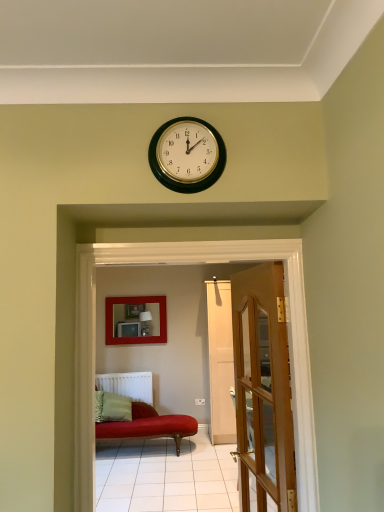
Question: Could you tell me if wooden glass door at center is turned towards green fabric pillow at lower left?

Choices:
 (A) no
 (B) yes

Answer: (A)

Question: From the image's perspective, does wooden glass door at center appear higher than green fabric pillow at lower left?

Choices:
 (A) yes
 (B) no

Answer: (A)

Question: Would you say wooden glass door at center is a long distance from green fabric pillow at lower left?

Choices:
 (A) yes
 (B) no

Answer: (A)

Question: Is wooden glass door at center wider than green fabric pillow at lower left?

Choices:
 (A) yes
 (B) no

Answer: (B)

Question: Considering the relative positions of wooden glass door at center and green fabric pillow at lower left in the image provided, is wooden glass door at center to the left of green fabric pillow at lower left from the viewer's perspective?

Choices:
 (A) yes
 (B) no

Answer: (B)

Question: In terms of height, does white matte radiator at lower left look taller or shorter compared to green fabric pillow at lower left?

Choices:
 (A) tall
 (B) short

Answer: (B)

Question: From a real-world perspective, is white matte radiator at lower left physically located above or below green fabric pillow at lower left?

Choices:
 (A) above
 (B) below

Answer: (A)

Question: From the image's perspective, is white matte radiator at lower left positioned above or below green fabric pillow at lower left?

Choices:
 (A) below
 (B) above

Answer: (B)

Question: Does point (135, 376) appear closer or farther from the camera than point (107, 404)?

Choices:
 (A) closer
 (B) farther

Answer: (B)

Question: In terms of size, does wooden glass door at center appear bigger or smaller than green fabric pillow at lower left?

Choices:
 (A) small
 (B) big

Answer: (B)

Question: Is wooden glass door at center wider or thinner than green fabric pillow at lower left?

Choices:
 (A) thin
 (B) wide

Answer: (A)

Question: Is point (256, 409) closer or farther from the camera than point (117, 403)?

Choices:
 (A) farther
 (B) closer

Answer: (B)

Question: Which is correct: wooden glass door at center is inside green fabric pillow at lower left, or outside of it?

Choices:
 (A) inside
 (B) outside

Answer: (B)

Question: From a real-world perspective, relative to wooden glass door at center, is matte red couch at center vertically above or below?

Choices:
 (A) below
 (B) above

Answer: (B)

Question: In the image, is matte red couch at center on the left side or the right side of wooden glass door at center?

Choices:
 (A) left
 (B) right

Answer: (A)